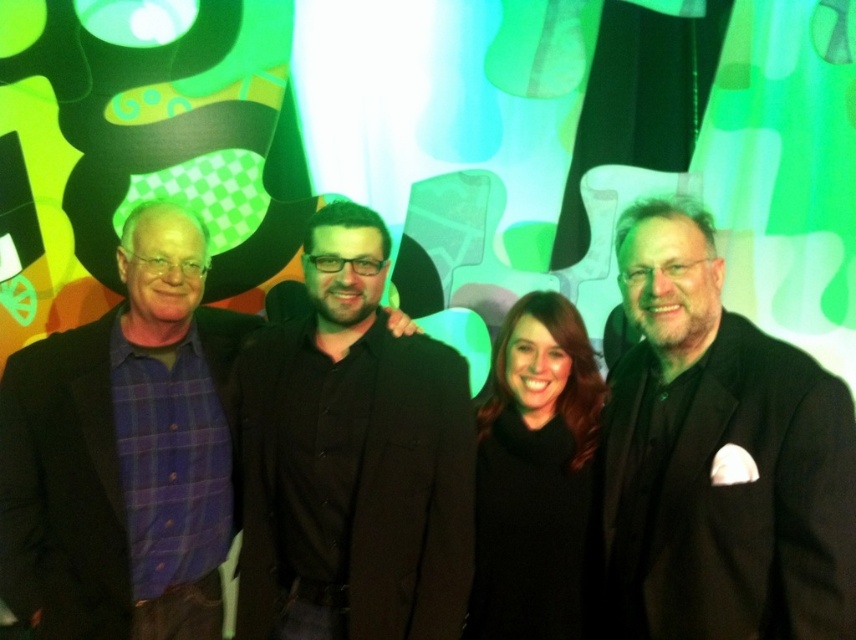
Question: Is black matte coat at center closer to camera compared to black woolen sweater at center?

Choices:
 (A) no
 (B) yes

Answer: (B)

Question: From the image, what is the correct spatial relationship of black pinstripe suit at right in relation to black matte coat at center?

Choices:
 (A) below
 (B) above

Answer: (B)

Question: Among these objects, which one is nearest to the camera?

Choices:
 (A) black woolen sweater at center
 (B) black pinstripe suit at right
 (C) black matte coat at center
 (D) purple plaid shirt at left

Answer: (B)

Question: Which object appears closest to the camera in this image?

Choices:
 (A) black matte coat at center
 (B) purple plaid shirt at left
 (C) black woolen sweater at center

Answer: (A)

Question: In this image, where is purple plaid shirt at left located relative to black woolen sweater at center?

Choices:
 (A) right
 (B) left

Answer: (B)

Question: Which point appears farthest from the camera in this image?

Choices:
 (A) (181, 388)
 (B) (441, 468)

Answer: (A)